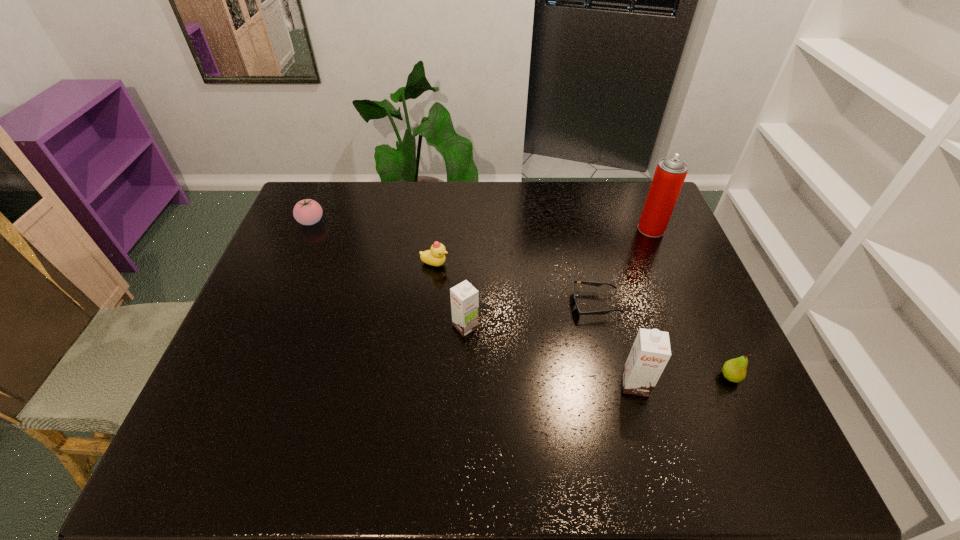
Where is `aerosol can located in the far edge section of the desktop`? aerosol can located in the far edge section of the desktop is located at coordinates (670, 173).

You are a GUI agent. You are given a task and a screenshot of the screen. Output one action in this format:
    pyautogui.click(x=<x>, y=<y>)
    Task: Click on the chocolate milk at the near edge
    This screenshot has height=540, width=960.
    Given the screenshot: What is the action you would take?
    pyautogui.click(x=651, y=351)

Where is `pear positioned at the near edge`? The width and height of the screenshot is (960, 540). pear positioned at the near edge is located at coordinates point(734,370).

Locate an element on the screen. This screenshot has height=540, width=960. object that is positioned at the left edge is located at coordinates (307, 212).

The width and height of the screenshot is (960, 540). I want to click on aerosol can at the right edge, so click(670, 173).

Find the location of a particular element. pear situated at the right edge is located at coordinates (734, 370).

The height and width of the screenshot is (540, 960). Find the location of `object that is at the far left corner`. object that is at the far left corner is located at coordinates (307, 212).

You are a GUI agent. You are given a task and a screenshot of the screen. Output one action in this format:
    pyautogui.click(x=<x>, y=<y>)
    Task: Click on the object at the far right corner
    This screenshot has width=960, height=540.
    Given the screenshot: What is the action you would take?
    [670, 173]

What are the coordinates of `object that is at the near right corner` in the screenshot? It's located at (734, 370).

Where is `vacant space at the far edge`? vacant space at the far edge is located at coordinates (379, 202).